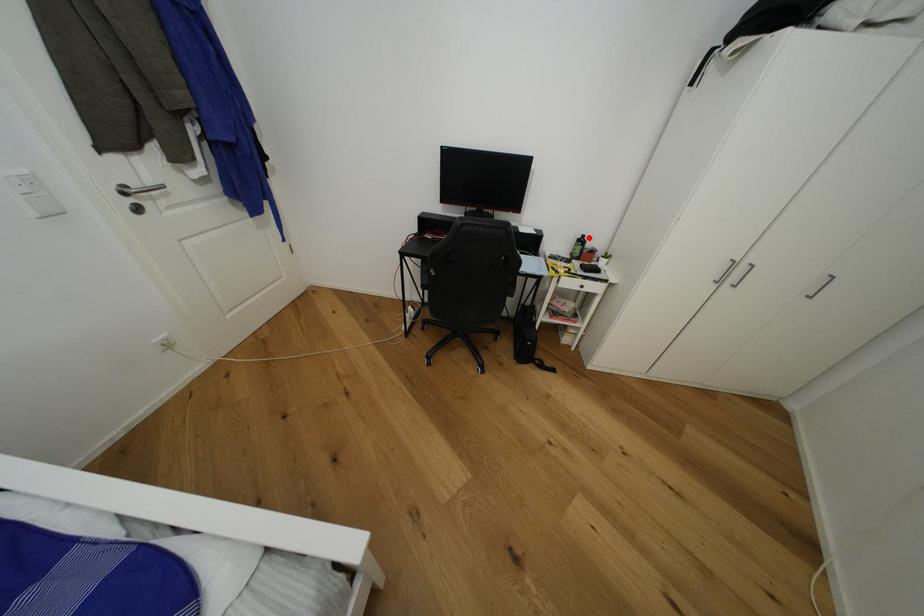
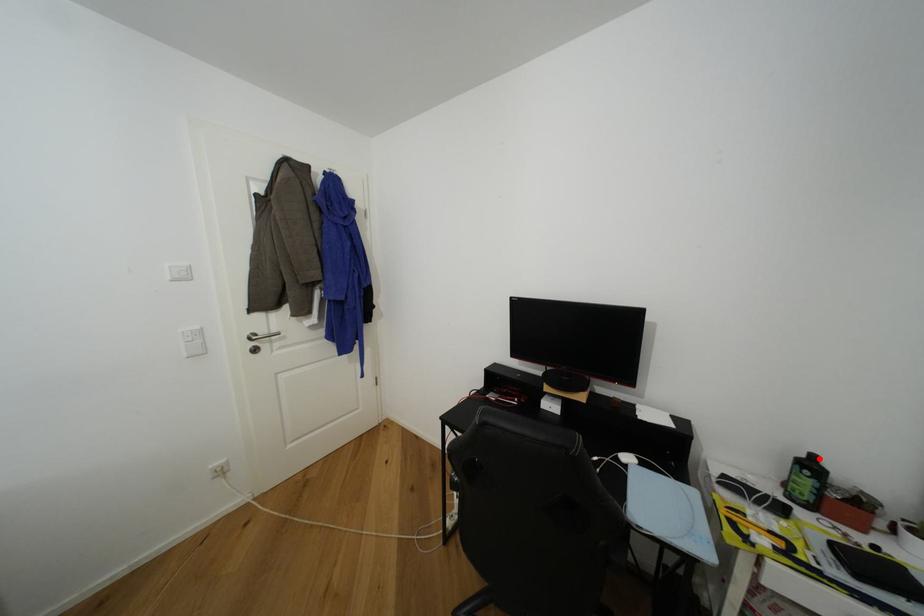
I am providing you with two images of the same scene from different viewpoints. A red point is marked on the first image and another point is marked on the second image. Is the red point in image1 aligned with the point shown in image2?

Yes